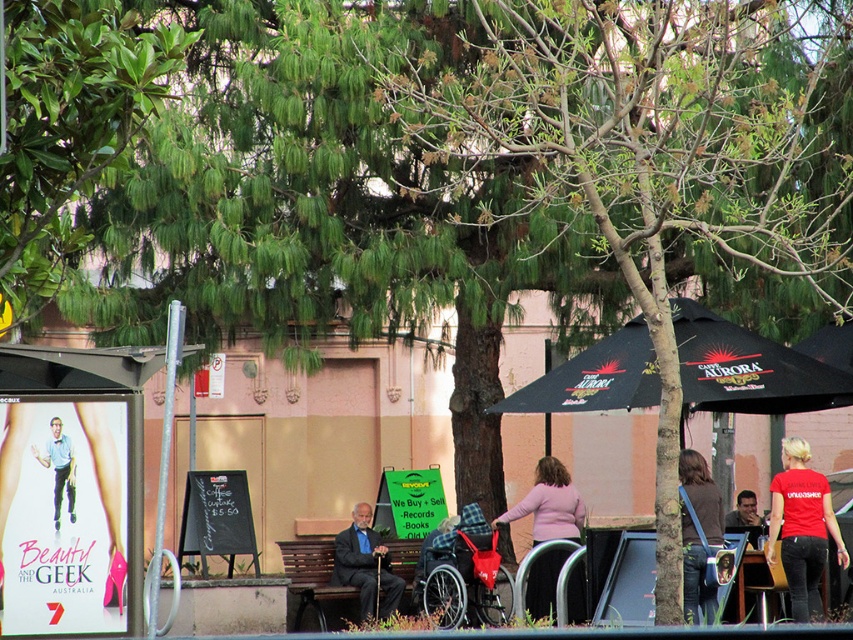
You are standing at the bus stop shelter on the left side of the image and want to find the pink fabric jacket at center. In which direction should you look relative to the bus stop shelter?

The pink fabric jacket at center is located at point (549,504), which is to the right and slightly forward of the bus stop shelter on the left side. So you should look to your right and towards the center of the image.

You are a delivery person carrying a package that is 6 feet long. You need to place it between the pink fabric jacket at center and the dark brown leather jacket at center. Is there enough space between them to fit the package?

The distance between the pink fabric jacket at center and the dark brown leather jacket at center is 6.27 feet, which is slightly longer than the 6 feet package. Therefore, there is just enough space to fit the package between them.